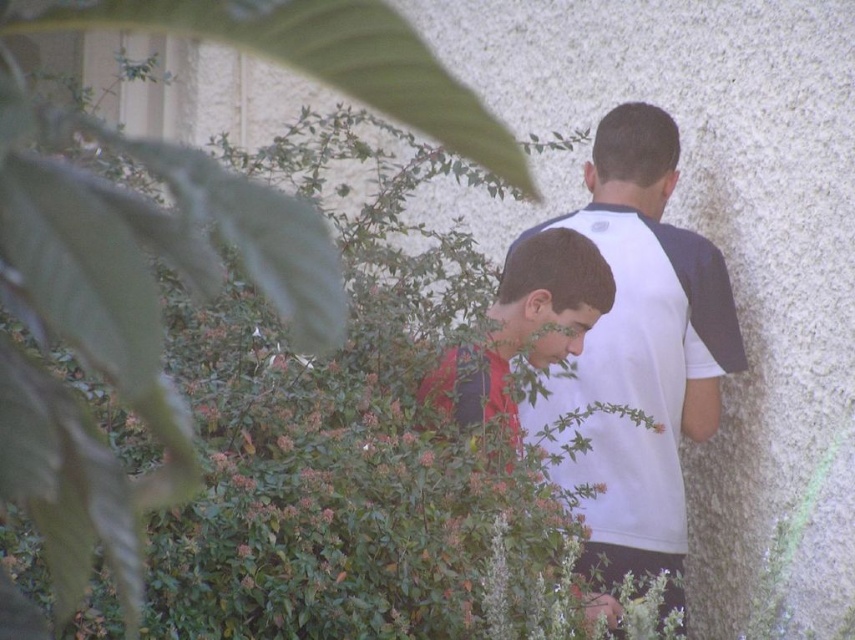
You are standing in a garden and see a point at coordinates (641, 348). According to the image, what object is located at that point?

The point at coordinates (641, 348) corresponds to the white fabric shirt at center.

You are a photographer trying to capture both the white fabric shirt at center and the matte red shirt at center in a single frame. Based on their positions, which shirt should you focus on first to ensure both are in the frame?

The white fabric shirt at center is located below the matte red shirt at center. To capture both in a single frame, focus on the matte red shirt at center first as it is higher up, ensuring the lower white fabric shirt at center will also be included.